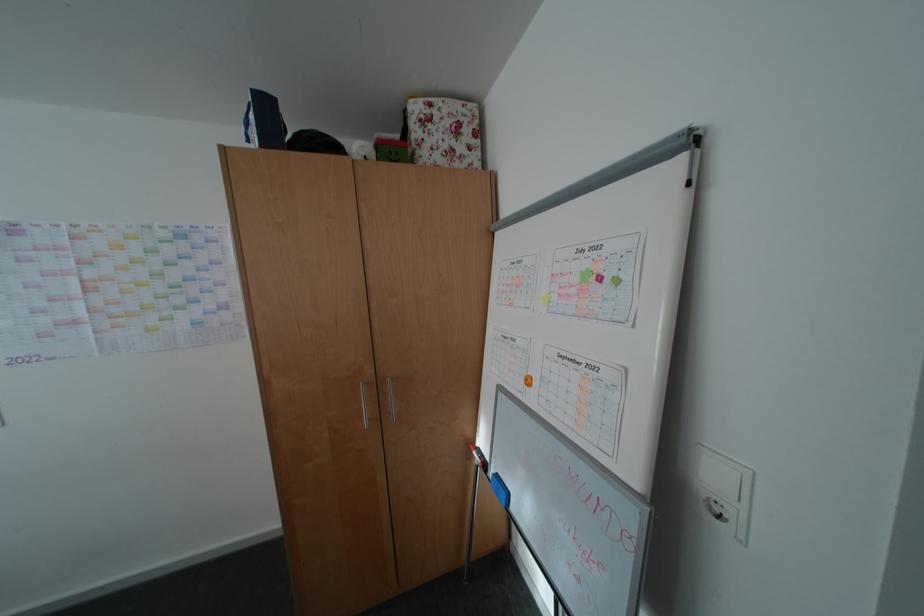
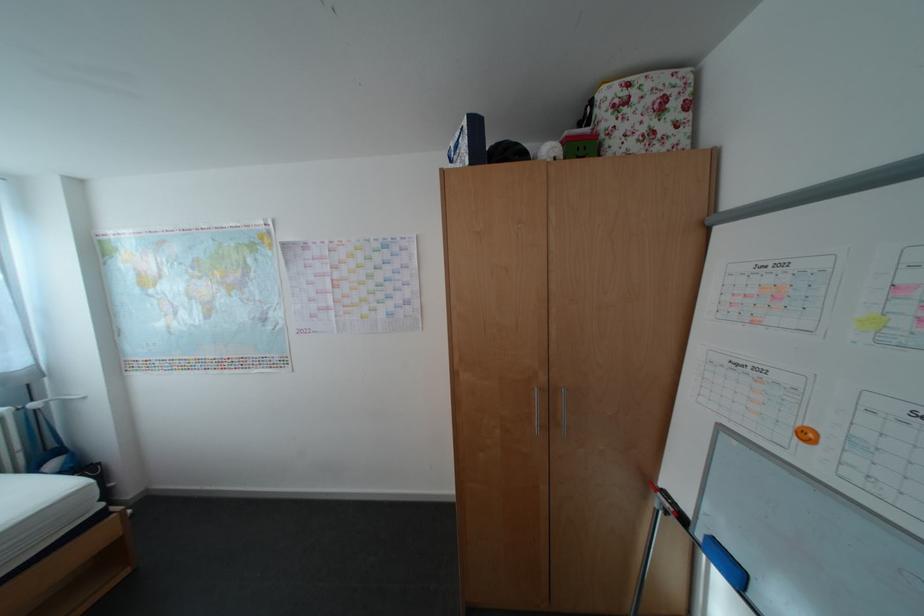
In the second image, find the point that corresponds to point (433, 102) in the first image.

(628, 84)